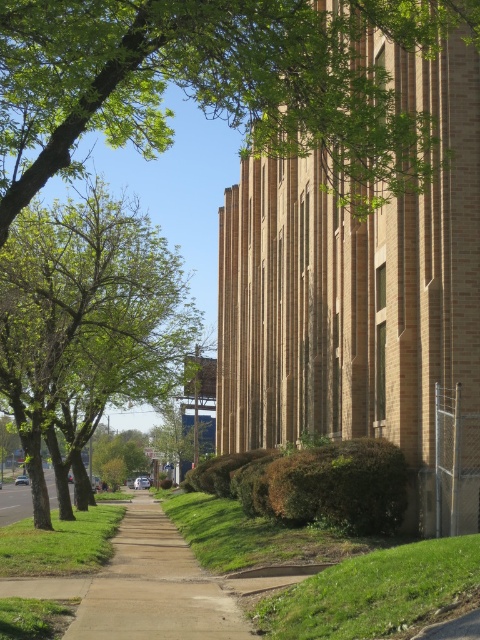
Is point (358, 614) positioned in front of point (141, 524)?

Yes, point (358, 614) is closer to viewer.

Is green grass at lower center smaller than brown concrete sidewalk at center?

Yes, green grass at lower center is smaller than brown concrete sidewalk at center.

Is point (399, 547) closer to camera compared to point (187, 632)?

No, it is behind (187, 632).

The width and height of the screenshot is (480, 640). I want to click on green grass at lower center, so click(377, 593).

Who is higher up, green leafy tree at left or brown concrete sidewalk at center?

Positioned higher is green leafy tree at left.

Identify the location of green leafy tree at left. The image size is (480, 640). (85, 321).

Who is more distant from viewer, (245,580) or (8,570)?

The point (8,570) is more distant.

Between point (208, 579) and point (12, 541), which one is positioned behind?

The point (12, 541) is more distant.

The width and height of the screenshot is (480, 640). I want to click on brown concrete sidewalk at center, so click(156, 588).